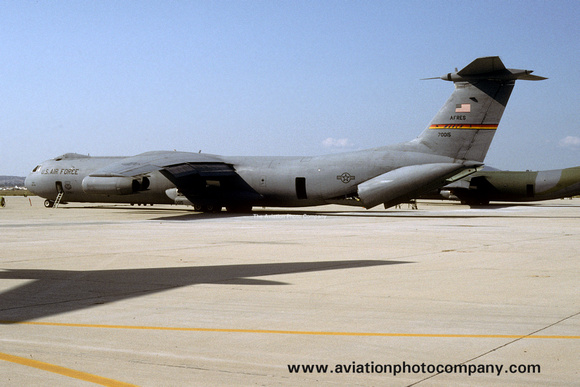
The image size is (580, 387). Identify the location of door. (61, 188).